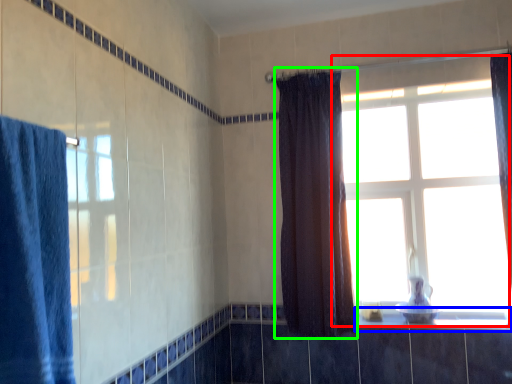
Question: Which object is positioned farthest from window (highlighted by a red box)? Select from window sill (highlighted by a blue box) and curtain (highlighted by a green box).

Choices:
 (A) window sill
 (B) curtain

Answer: (A)